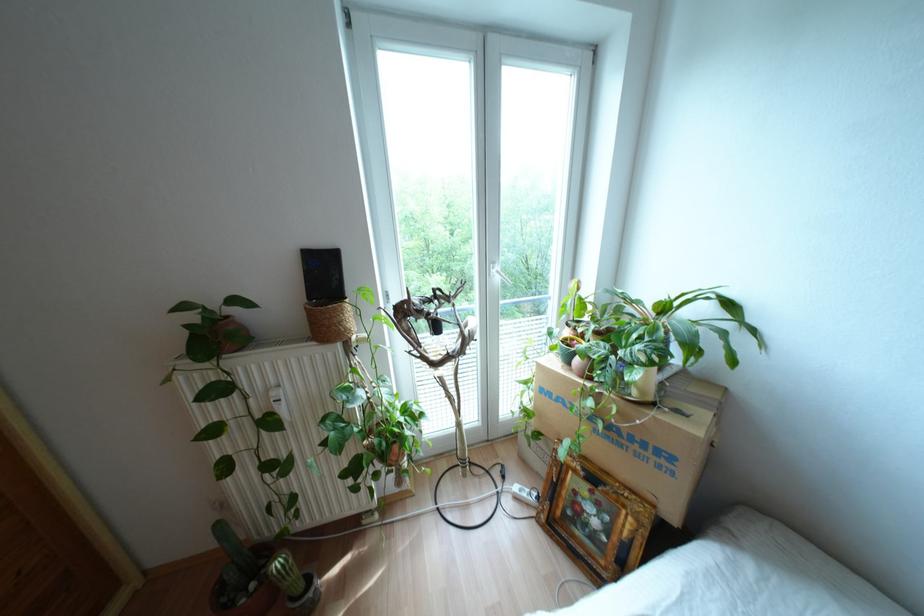
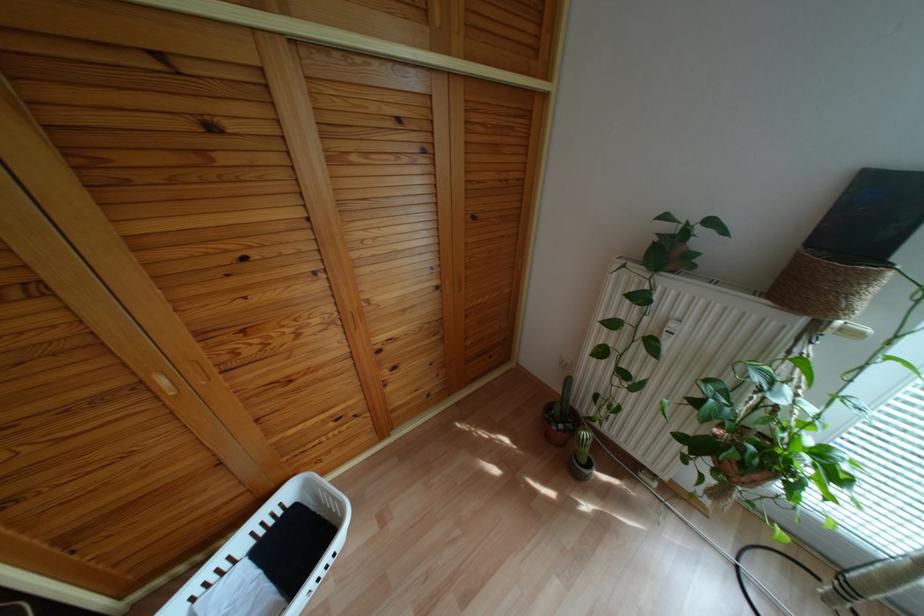
In the second image, find the point that corresponds to pixel 353 338 in the first image.

(839, 322)